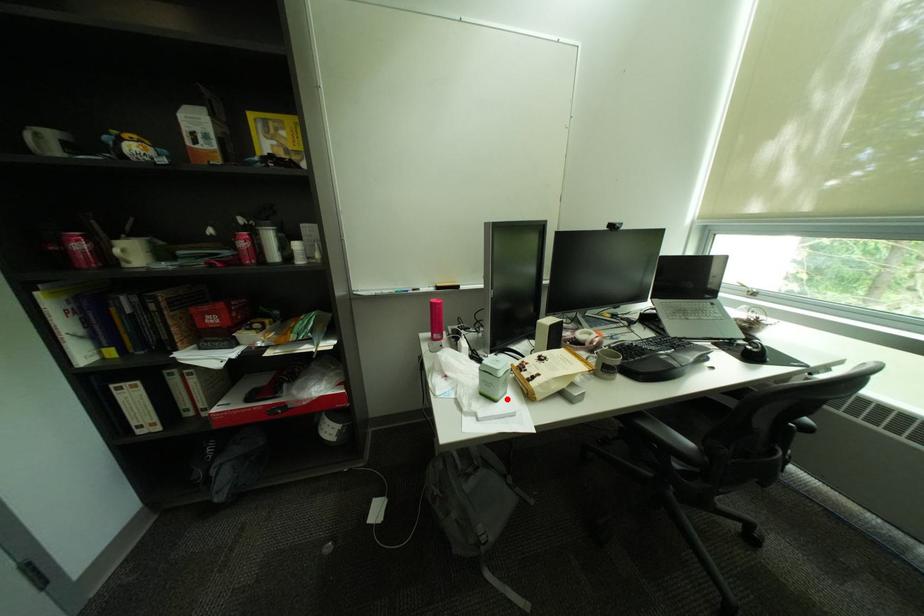
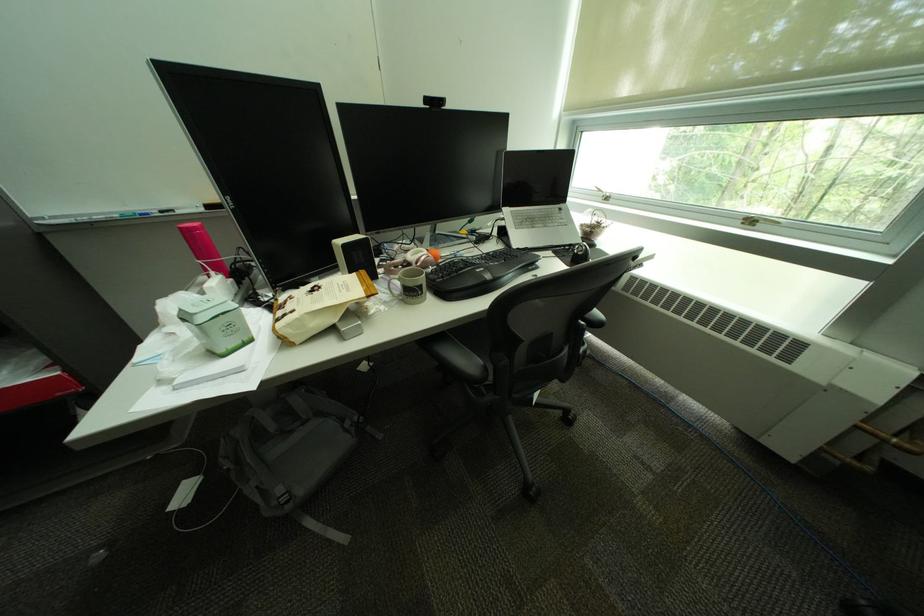
The point at the highlighted location is marked in the first image. Where is the corresponding point in the second image?

(232, 353)